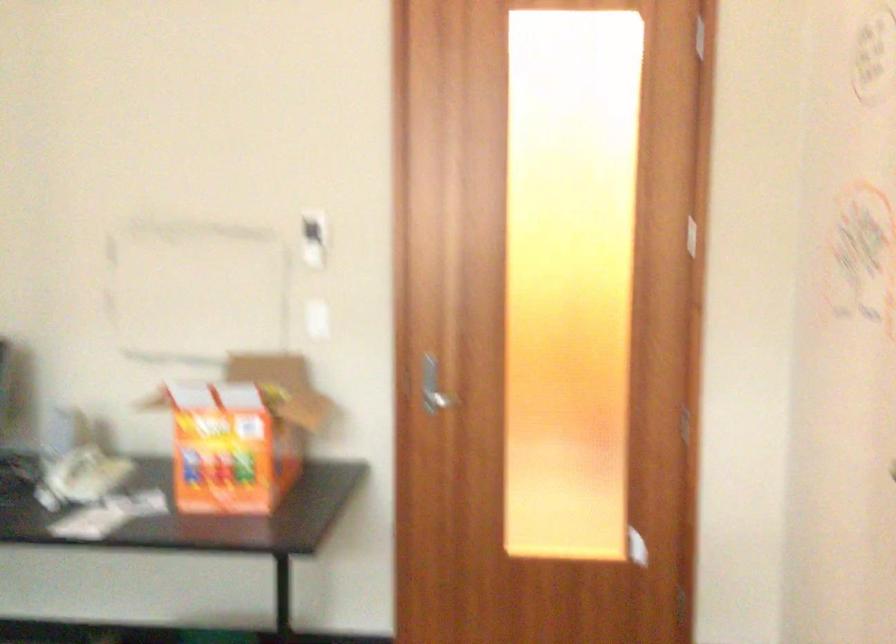
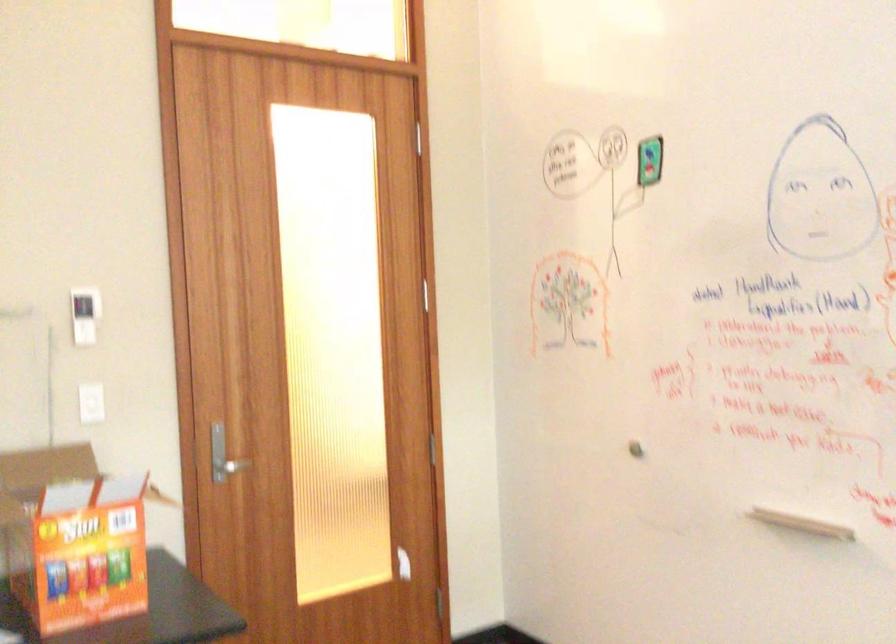
Where in the second image is the point corresponding to (307,239) from the first image?

(84, 315)